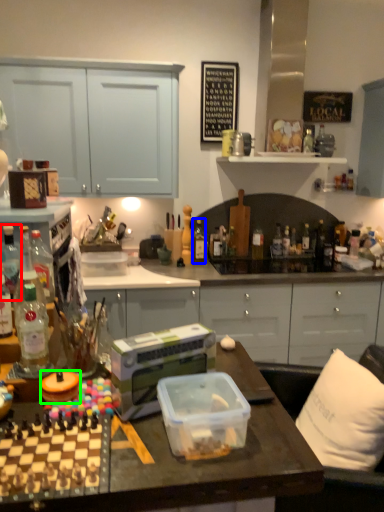
Question: Based on their relative distances, which object is nearer to bottle (highlighted by a red box)? Choose from bottle (highlighted by a blue box) and appliance (highlighted by a green box).

Choices:
 (A) bottle
 (B) appliance

Answer: (B)